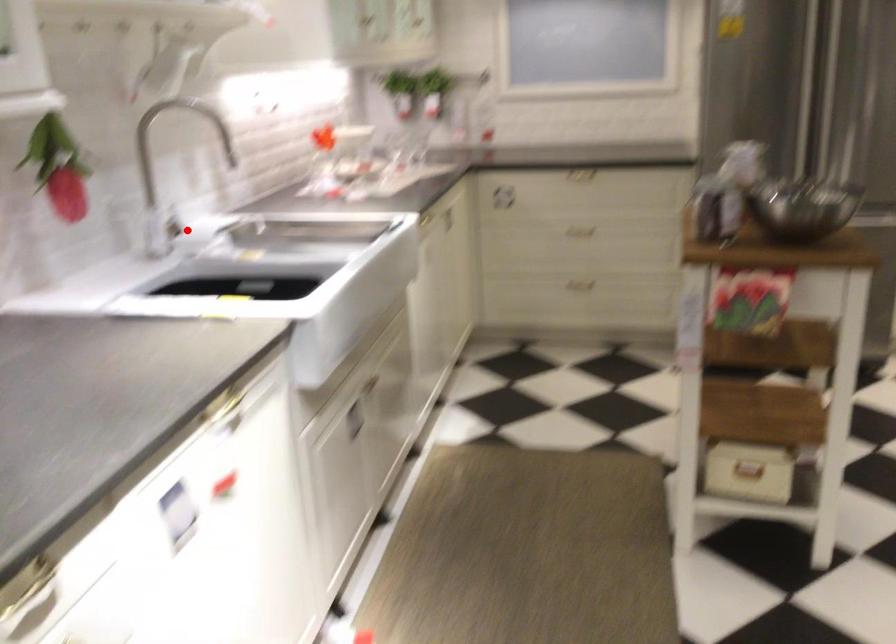
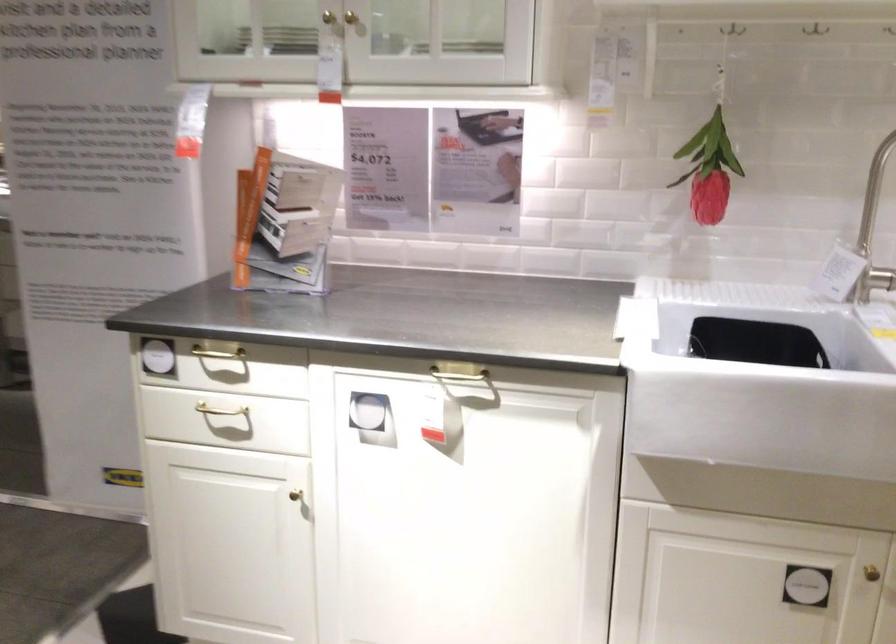
Question: I am providing you with two images of the same scene from different viewpoints. A red point is shown in image1. For the corresponding object point in image2, is it positioned nearer or farther from the camera?

Choices:
 (A) Nearer
 (B) Farther

Answer: (A)